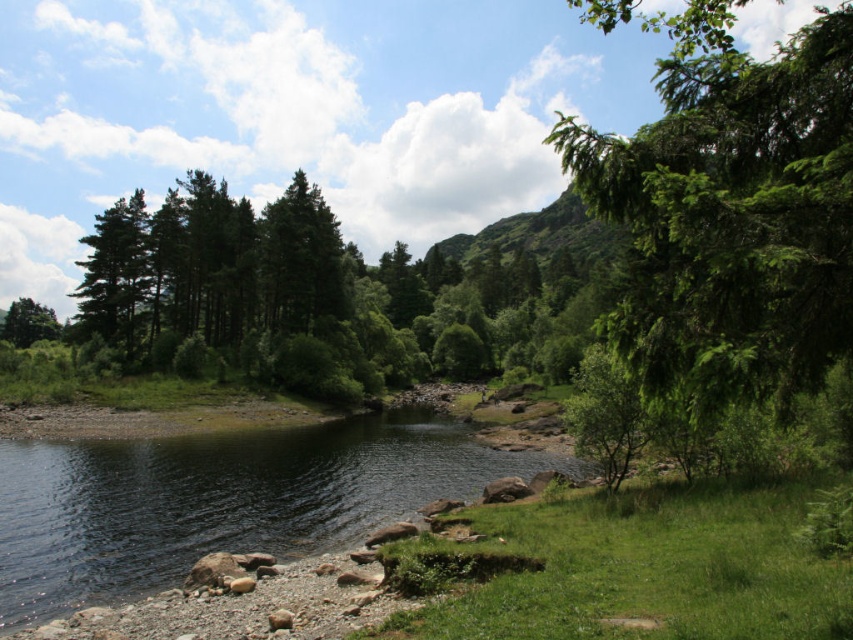
Can you confirm if green leafy tree at right is smaller than green grassy river at lower left?

Actually, green leafy tree at right might be larger than green grassy river at lower left.

How far apart are green leafy tree at right and green grassy river at lower left?

green leafy tree at right and green grassy river at lower left are 69.79 feet apart.

In order to click on green leafy tree at right in this screenshot , I will do `click(732, 216)`.

Image resolution: width=853 pixels, height=640 pixels. Find the location of `green leafy tree at right`. green leafy tree at right is located at coordinates (732, 216).

Which of these two, green leafy tree at right or green matte tree at left, stands shorter?

green matte tree at left is shorter.

Does point (579, 132) come in front of point (1, 332)?

Yes, point (579, 132) is in front of point (1, 332).

Where is `green leafy tree at right`? This screenshot has height=640, width=853. green leafy tree at right is located at coordinates (732, 216).

Which is in front, point (270, 474) or point (15, 323)?

Positioned in front is point (270, 474).

Can you confirm if green grassy river at lower left is taller than green matte tree at left?

No.

In order to click on green grassy river at lower left in this screenshot , I will do `click(219, 500)`.